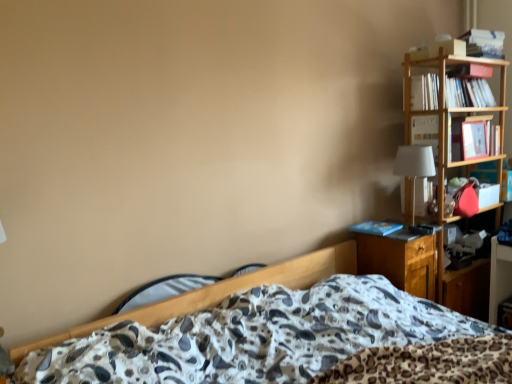
Locate an element on the screen. The width and height of the screenshot is (512, 384). blank space situated above hardcover book at upper right, the 3th book when ordered from top to bottom (from a real-world perspective) is located at coordinates (432, 109).